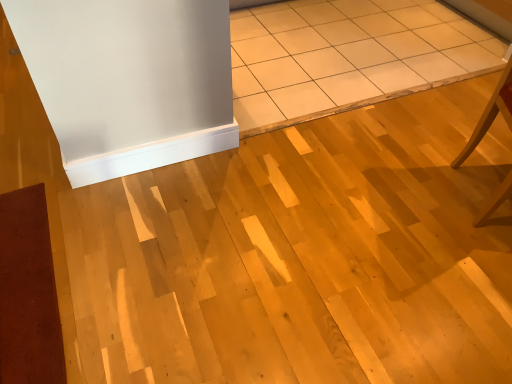
The width and height of the screenshot is (512, 384). Find the location of `vacant region in front of wooden chair leg at right`. vacant region in front of wooden chair leg at right is located at coordinates (473, 263).